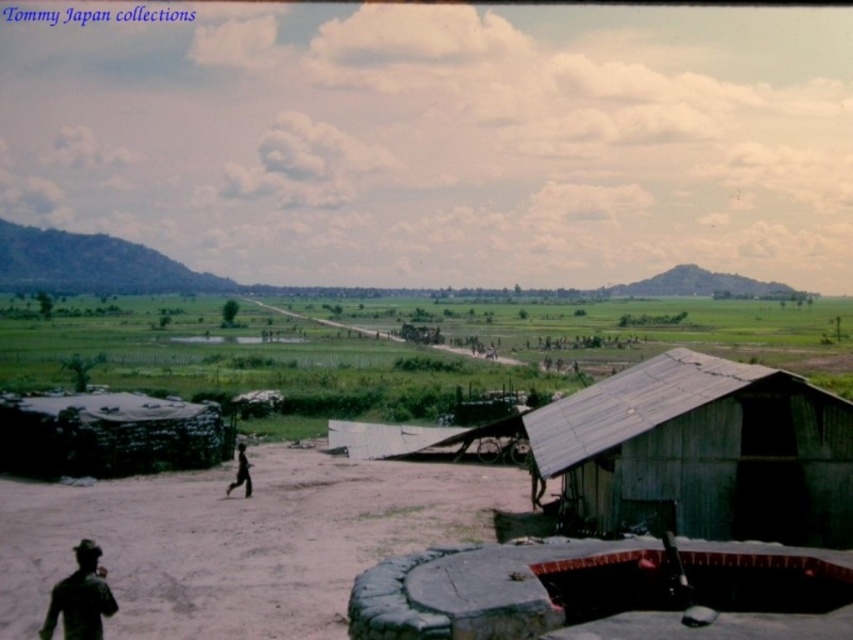
Question: Among these objects, which one is nearest to the camera?

Choices:
 (A) wooden shack at lower right
 (B) black matte figure at center
 (C) dark green uniform at lower left

Answer: (C)

Question: Where is dark green uniform at lower left located in relation to black matte figure at center in the image?

Choices:
 (A) above
 (B) below

Answer: (A)

Question: Can you confirm if wooden shack at lower right is bigger than black matte figure at center?

Choices:
 (A) no
 (B) yes

Answer: (B)

Question: Considering the real-world distances, which object is farthest from the dark green uniform at lower left?

Choices:
 (A) wooden shack at lower right
 (B) black matte figure at center

Answer: (B)

Question: Is wooden shack at lower right wider than black matte figure at center?

Choices:
 (A) yes
 (B) no

Answer: (A)

Question: Which of the following is the farthest from the observer?

Choices:
 (A) black matte figure at center
 (B) dark green uniform at lower left

Answer: (A)